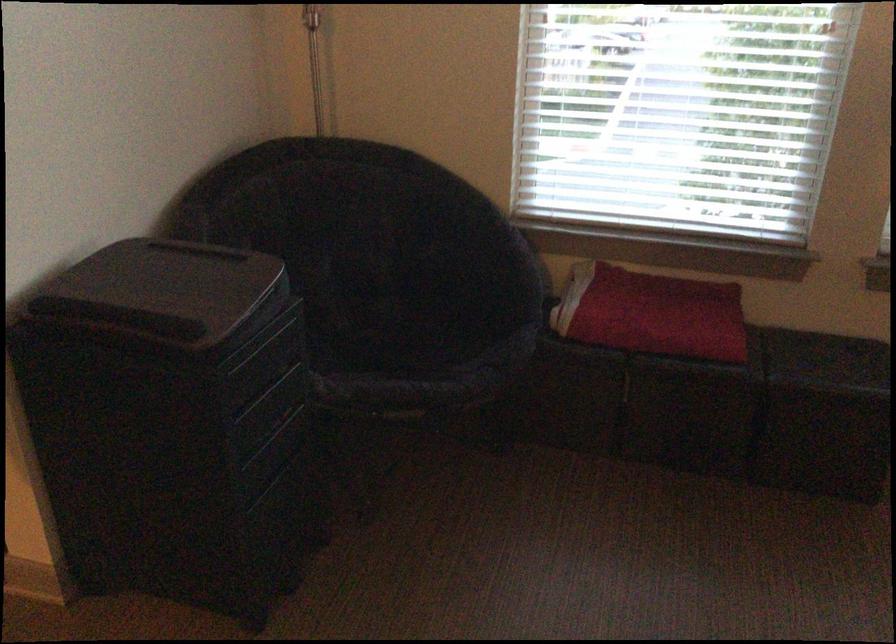
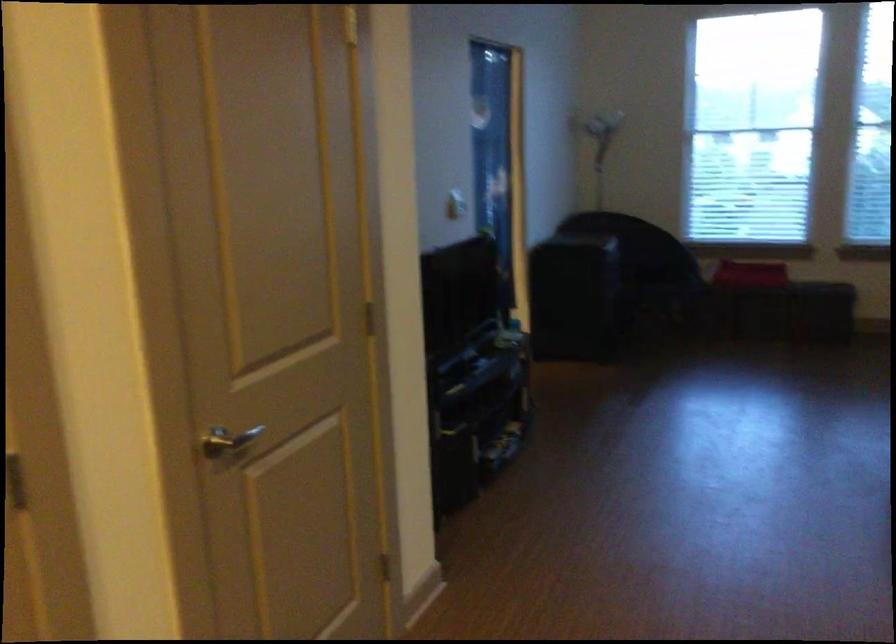
Question: The images are taken continuously from a first-person perspective. In which direction are you moving?

Choices:
 (A) Left
 (B) Right
 (C) Forward
 (D) Backward

Answer: (D)